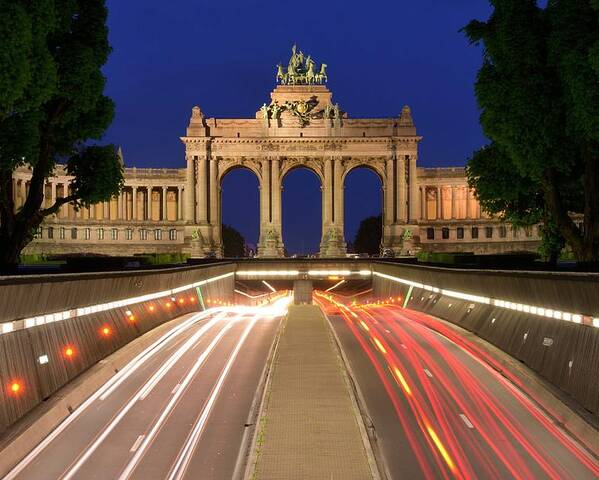
Locate an element on the screen. The image size is (599, 480). red lights is located at coordinates (429, 437).